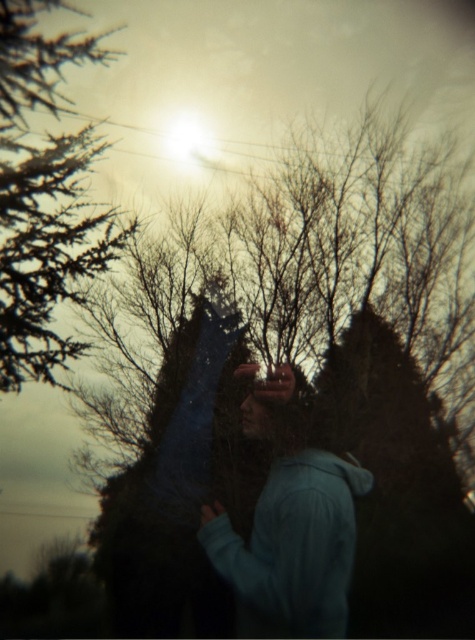
Question: Which point is farther to the camera?

Choices:
 (A) (208, 538)
 (B) (47, 317)

Answer: (B)

Question: Does green needle-like at left have a lesser width compared to blue fleece jacket at center?

Choices:
 (A) no
 (B) yes

Answer: (B)

Question: Can you confirm if green needle-like at left is positioned to the left of blue fleece jacket at center?

Choices:
 (A) no
 (B) yes

Answer: (B)

Question: Which object is farther from the camera taking this photo?

Choices:
 (A) green needle-like at left
 (B) blue fleece jacket at center

Answer: (A)

Question: Among these objects, which one is nearest to the camera?

Choices:
 (A) green needle-like at left
 (B) blue fleece jacket at center

Answer: (B)

Question: Observing the image, what is the correct spatial positioning of green needle-like at left in reference to blue fleece jacket at center?

Choices:
 (A) left
 (B) right

Answer: (A)